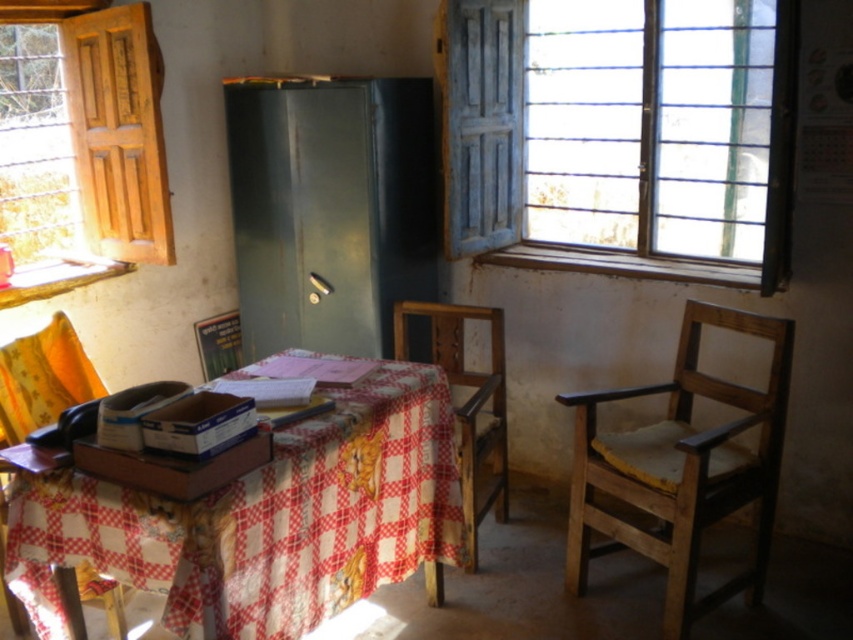
You are moving a small plant pot that is 0.5 meters wide. You want to place it between the metallic gray fridge at center and the wooden chair at center. Is there enough space for the plant pot?

The metallic gray fridge at center is larger than the wooden chair at center, but the exact distance between them isn

You are a delivery person who needs to place a large package between the wooden chair at right and the yellow fabric chair at left. The package requires 6 feet of space. Can you fit it between them?

The distance between the wooden chair at right and yellow fabric chair at left is 6.30 feet, which is more than enough to accommodate the 6 feet required for the package. Yes, you can fit it between them.